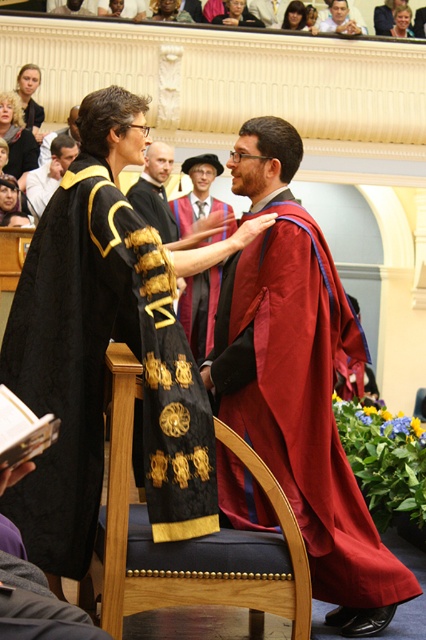
You are attending the ceremony and want to describe the two main figures. Which object is bigger in size between the matte black robe at center and the smooth brown hair at upper center?

The matte black robe at center is larger in size than the smooth brown hair at upper center.

In the scene shown: You are attending a formal academic ceremony in a large hall. You see a maroon velvet graduation gown at center. Can you estimate its position relative to the center of the hall using the coordinate system provided?

The maroon velvet graduation gown at center is located exactly at the coordinates point [199,310], which is very close to the center of the hall.